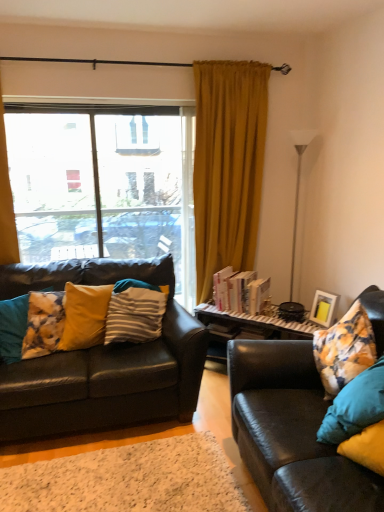
Locate an element on the screen. This screenshot has height=512, width=384. white glossy floor lamp at right is located at coordinates (298, 187).

Describe the element at coordinates (298, 187) in the screenshot. I see `white glossy floor lamp at right` at that location.

What do you see at coordinates (240, 291) in the screenshot? The height and width of the screenshot is (512, 384). I see `hardcover books at center` at bounding box center [240, 291].

Measure the distance between point (15, 362) and camera.

They are 2.60 meters apart.

The width and height of the screenshot is (384, 512). In order to click on mustard yellow fabric curtain at left, arranged as the 1th curtain when viewed from the left in this screenshot , I will do `click(6, 203)`.

The image size is (384, 512). Find the location of `white glossy floor lamp at right`. white glossy floor lamp at right is located at coordinates (298, 187).

Identify the location of picture frame on the right of the mustard yellow fabric curtain at left, the 2th curtain when ordered from right to left. click(x=323, y=308).

From the image's perspective, does matte yellow picture frame at right appear higher than mustard yellow fabric curtain at left, the 2th curtain when ordered from right to left?

No, from the image's perspective, matte yellow picture frame at right is not above mustard yellow fabric curtain at left, the 2th curtain when ordered from right to left.

Is matte yellow picture frame at right not near mustard yellow fabric curtain at left, the 2th curtain when ordered from right to left?

matte yellow picture frame at right is positioned a significant distance from mustard yellow fabric curtain at left, the 2th curtain when ordered from right to left.

Measure the distance from matte yellow picture frame at right to mustard yellow fabric curtain at left, the 2th curtain when ordered from right to left.

They are 7.37 feet apart.

Considering the relative sizes of white textured rug at lower center and matte yellow picture frame at right in the image provided, is white textured rug at lower center thinner than matte yellow picture frame at right?

No.

Can you tell me how much white textured rug at lower center and matte yellow picture frame at right differ in facing direction?

The angle between the facing direction of white textured rug at lower center and the facing direction of matte yellow picture frame at right is 73.4 degrees.

Does point (37, 509) appear closer or farther from the camera than point (333, 305)?

Point (37, 509) is positioned closer to the camera compared to point (333, 305).

From the image's perspective, would you say white textured rug at lower center is shown under matte yellow picture frame at right?

Correct, white textured rug at lower center appears lower than matte yellow picture frame at right in the image.

From the image's perspective, relative to yellow striped pillow at left, which is the third pillow from left to right, is fluffy yellow pillow at left, arranged as the third pillow when viewed from the right, above or below?

fluffy yellow pillow at left, arranged as the third pillow when viewed from the right, is situated lower than yellow striped pillow at left, which is the third pillow from left to right, in the image.

From a real-world perspective, is fluffy yellow pillow at left, arranged as the third pillow when viewed from the right, under yellow striped pillow at left, arranged as the first pillow when viewed from the right?

Indeed, from a real-world perspective, fluffy yellow pillow at left, arranged as the third pillow when viewed from the right, is positioned beneath yellow striped pillow at left, arranged as the first pillow when viewed from the right.

Between fluffy yellow pillow at left, arranged as the third pillow when viewed from the right, and yellow striped pillow at left, arranged as the first pillow when viewed from the right, which one is positioned behind?

yellow striped pillow at left, arranged as the first pillow when viewed from the right.

Which object is positioned more to the right, hardcover books at center or yellow striped pillow at left, arranged as the first pillow when viewed from the right?

hardcover books at center is more to the right.

Is hardcover books at center positioned beyond the bounds of yellow striped pillow at left, which is the third pillow from left to right?

hardcover books at center lies outside yellow striped pillow at left, which is the third pillow from left to right,'s area.

From a real-world perspective, is hardcover books at center positioned above or below yellow striped pillow at left, which is the third pillow from left to right?

hardcover books at center is below yellow striped pillow at left, which is the third pillow from left to right.

What's the angular difference between hardcover books at center and yellow striped pillow at left, arranged as the first pillow when viewed from the right,'s facing directions?

The facing directions of hardcover books at center and yellow striped pillow at left, arranged as the first pillow when viewed from the right, are 40.2 degrees apart.

Could you tell me if clear glass window at center is turned towards hardcover books at center?

No, clear glass window at center does not turn towards hardcover books at center.

Is clear glass window at center spatially inside hardcover books at center, or outside of it?

The correct answer is: outside.

Can you confirm if clear glass window at center is thinner than hardcover books at center?

Yes, clear glass window at center is thinner than hardcover books at center.

Based on the photo, how much distance is there between clear glass window at center and hardcover books at center?

clear glass window at center and hardcover books at center are 1.01 meters apart from each other.

Starting from the fluffy yellow pillow at left, which appears as the first pillow when viewed from the left, which curtain is the 2nd one behind? Please provide its 2D coordinates.

[(228, 165)]

Which is in front, fluffy yellow pillow at left, arranged as the third pillow when viewed from the right, or mustard yellow velvet curtain at center, positioned as the first curtain in right-to-left order?

fluffy yellow pillow at left, arranged as the third pillow when viewed from the right, is closer to the camera.

How much distance is there between fluffy yellow pillow at left, arranged as the third pillow when viewed from the right, and mustard yellow velvet curtain at center, positioned as the first curtain in right-to-left order?

A distance of 5.36 feet exists between fluffy yellow pillow at left, arranged as the third pillow when viewed from the right, and mustard yellow velvet curtain at center, positioned as the first curtain in right-to-left order.

Is fluffy yellow pillow at left, which appears as the first pillow when viewed from the left, inside the boundaries of mustard yellow velvet curtain at center, positioned as the first curtain in right-to-left order, or outside?

fluffy yellow pillow at left, which appears as the first pillow when viewed from the left, is outside mustard yellow velvet curtain at center, positioned as the first curtain in right-to-left order.

Considering the relative sizes of yellow striped pillow at left, arranged as the first pillow when viewed from the right, and leather couch at left, the 2th studio couch from the right, in the image provided, is yellow striped pillow at left, arranged as the first pillow when viewed from the right, wider than leather couch at left, the 2th studio couch from the right,?

Incorrect, the width of yellow striped pillow at left, arranged as the first pillow when viewed from the right, does not surpass that of leather couch at left, the 2th studio couch from the right.

Is point (119, 284) closer to camera compared to point (14, 296)?

No, (119, 284) is behind (14, 296).

Who is smaller, yellow striped pillow at left, arranged as the first pillow when viewed from the right, or leather couch at left, the 2th studio couch from the right?

yellow striped pillow at left, arranged as the first pillow when viewed from the right.

Would you say leather couch at left, which is the first studio couch from left to right, is part of yellow striped pillow at left, which is the third pillow from left to right,'s contents?

No, leather couch at left, which is the first studio couch from left to right, is not inside yellow striped pillow at left, which is the third pillow from left to right.

You are a GUI agent. You are given a task and a screenshot of the screen. Output one action in this format:
    pyautogui.click(x=<x>, y=<y>)
    Task: Click on the picture frame behind the mustard yellow fabric curtain at left, the 2th curtain when ordered from right to left
    This screenshot has height=512, width=384.
    Given the screenshot: What is the action you would take?
    pyautogui.click(x=323, y=308)

Locate an element on the screen. picture frame above the white textured rug at lower center (from a real-world perspective) is located at coordinates (323, 308).

Looking at the image, which one is located further to white glossy floor lamp at right, mustard yellow velvet curtain at center, positioned as the first curtain in right-to-left order, or matte yellow picture frame at right?

Based on the image, matte yellow picture frame at right appears to be further to white glossy floor lamp at right.

Considering their positions, is white textured rug at lower center positioned further to white glossy floor lamp at right than matte yellow picture frame at right?

white textured rug at lower center is further to white glossy floor lamp at right.

Considering their positions, is yellow fabric pillow at left, acting as the second pillow starting from the left, positioned closer to matte yellow picture frame at right than mustard yellow velvet curtain at center, the second curtain from the left?

mustard yellow velvet curtain at center, the second curtain from the left, is positioned closer to the anchor matte yellow picture frame at right.

Based on their spatial positions, is clear glass window at center or hardcover books at center further from yellow striped pillow at left, arranged as the first pillow when viewed from the right?

Based on the image, clear glass window at center appears to be further to yellow striped pillow at left, arranged as the first pillow when viewed from the right.

Based on their spatial positions, is yellow fabric pillow at left, acting as the second pillow starting from the left, or matte yellow picture frame at right closer to mustard yellow velvet curtain at center, positioned as the first curtain in right-to-left order?

Based on the image, matte yellow picture frame at right appears to be nearer to mustard yellow velvet curtain at center, positioned as the first curtain in right-to-left order.

Considering their positions, is mustard yellow velvet curtain at center, the second curtain from the left, positioned closer to yellow fabric pillow at left, acting as the second pillow starting from the left, than matte yellow picture frame at right?

mustard yellow velvet curtain at center, the second curtain from the left, is closer to yellow fabric pillow at left, acting as the second pillow starting from the left.

Which object lies further to the anchor point white textured rug at lower center, yellow fabric pillow at left, acting as the second pillow starting from the left, or white glossy floor lamp at right?

Among the two, white glossy floor lamp at right is located further to white textured rug at lower center.

Based on their spatial positions, is yellow fabric pillow at left, the 2th pillow when ordered from right to left, or mustard yellow fabric curtain at left, the 2th curtain when ordered from right to left, further from matte black couch at right, the first studio couch from the right?

The object further to matte black couch at right, the first studio couch from the right, is mustard yellow fabric curtain at left, the 2th curtain when ordered from right to left.

Where is `lamp between leather couch at left, the 2th studio couch from the right, and matte yellow picture frame at right`? The image size is (384, 512). lamp between leather couch at left, the 2th studio couch from the right, and matte yellow picture frame at right is located at coordinates (298, 187).

This screenshot has width=384, height=512. In order to click on studio couch positioned between white textured rug at lower center and hardcover books at center from near to far in this screenshot , I will do `click(102, 361)`.

Find the location of a particular element. This screenshot has width=384, height=512. picture frame positioned between matte black couch at right, the 2th studio couch when ordered from left to right, and white glossy floor lamp at right from near to far is located at coordinates (323, 308).

Where is `flat between yellow fabric pillow at left, the 2th pillow when ordered from right to left, and matte yellow picture frame at right`? This screenshot has width=384, height=512. flat between yellow fabric pillow at left, the 2th pillow when ordered from right to left, and matte yellow picture frame at right is located at coordinates (128, 479).